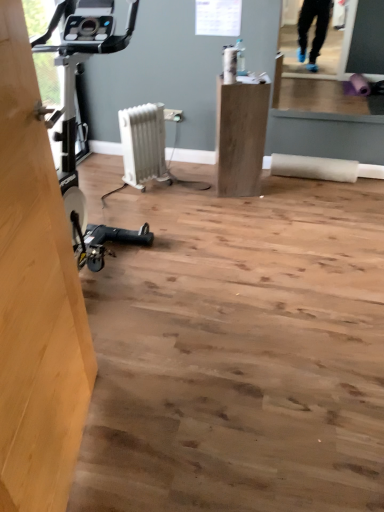
Question: Considering the positions of white plastic radiator at center and matte wood cabinet at center in the image, is white plastic radiator at center wider or thinner than matte wood cabinet at center?

Choices:
 (A) thin
 (B) wide

Answer: (A)

Question: Does point (x=155, y=156) appear closer or farther from the camera than point (x=233, y=193)?

Choices:
 (A) closer
 (B) farther

Answer: (B)

Question: Based on their relative distances, which object is farther from the white plastic radiator at center?

Choices:
 (A) matte wood cabinet at center
 (B) light brown wood at left

Answer: (B)

Question: Which object is positioned farthest from the light brown wood at left?

Choices:
 (A) matte wood cabinet at center
 (B) white plastic radiator at center

Answer: (B)